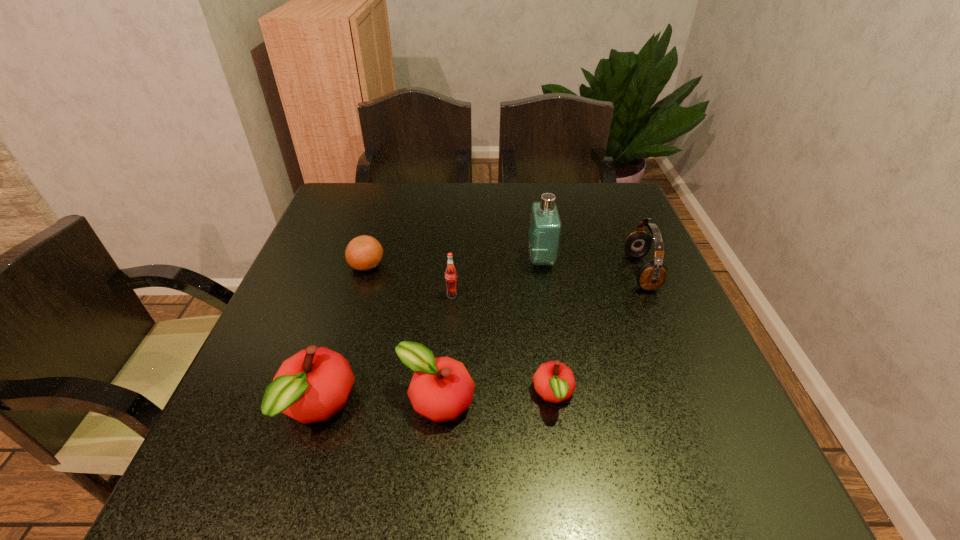
Image resolution: width=960 pixels, height=540 pixels. I want to click on free space for a new apple on the right, so click(x=667, y=389).